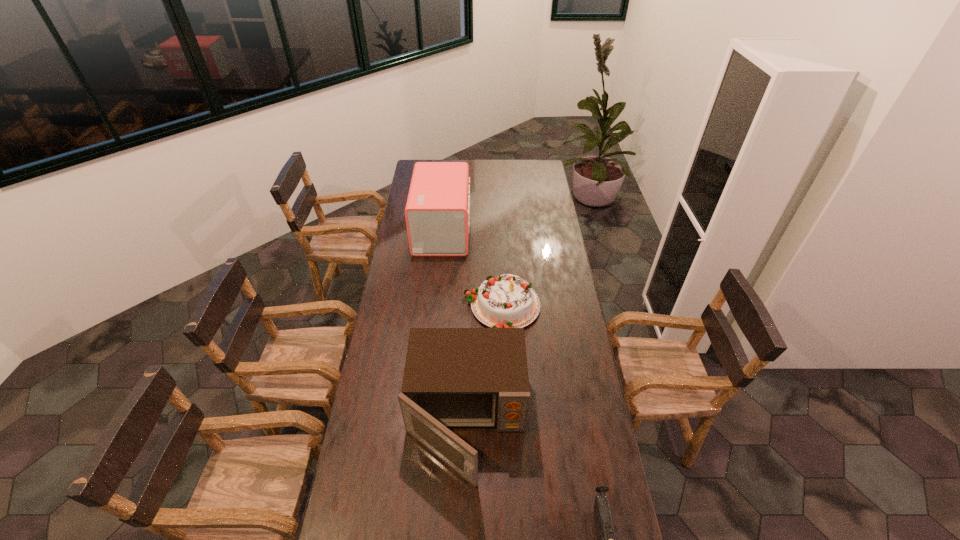
Where is `vacant region that satisfies the following two spatial constraints: 1. on the back side of the cake; 2. on the surface of the box where the text is embossed`? Image resolution: width=960 pixels, height=540 pixels. vacant region that satisfies the following two spatial constraints: 1. on the back side of the cake; 2. on the surface of the box where the text is embossed is located at coordinates 498,230.

The height and width of the screenshot is (540, 960). I want to click on free space that satisfies the following two spatial constraints: 1. on the surface of the tallest object where the text is embossed; 2. on the left side of the second shortest object, so click(x=434, y=307).

Locate an element on the screen. This screenshot has height=540, width=960. vacant space that satisfies the following two spatial constraints: 1. on the surface of the box where the text is embossed; 2. on the right side of the third nearest object is located at coordinates (434, 307).